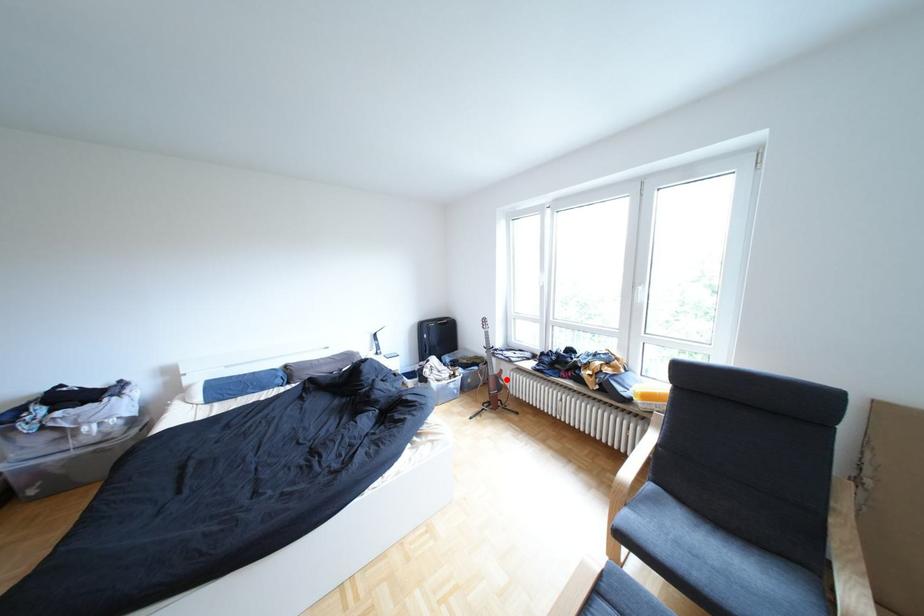
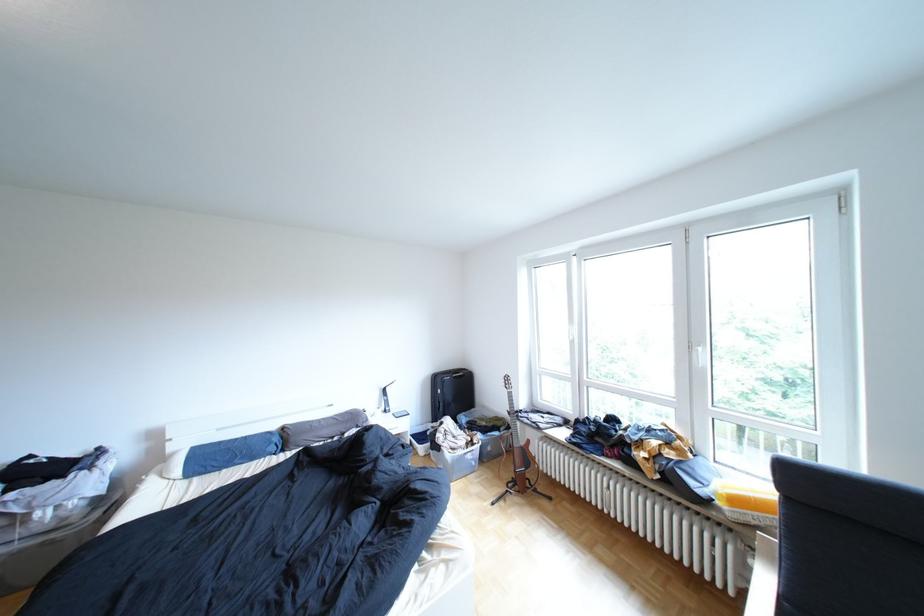
The point at the highlighted location is marked in the first image. Where is the corresponding point in the second image?

(532, 453)